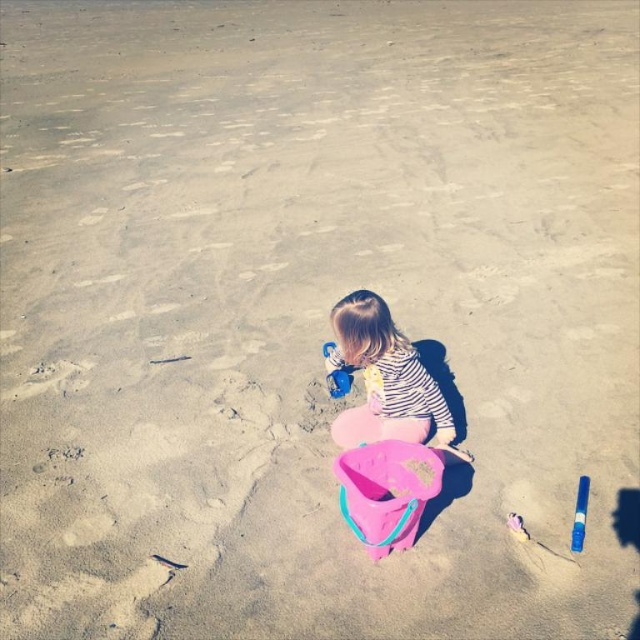
Does striped fabric child at center appear on the right side of blue plastic bucket at center?

Correct, you'll find striped fabric child at center to the right of blue plastic bucket at center.

Can you confirm if striped fabric child at center is smaller than blue plastic bucket at center?

No, striped fabric child at center is not smaller than blue plastic bucket at center.

Is point (384, 387) farther from camera compared to point (339, 380)?

No, it is in front of (339, 380).

You are a GUI agent. You are given a task and a screenshot of the screen. Output one action in this format:
    pyautogui.click(x=<x>, y=<y>)
    Task: Click on the striped fabric child at center
    This screenshot has height=640, width=640.
    Given the screenshot: What is the action you would take?
    pyautogui.click(x=385, y=380)

Does striped fabric child at center come in front of blue plastic marker at lower right?

No, it is behind blue plastic marker at lower right.

The image size is (640, 640). Describe the element at coordinates (385, 380) in the screenshot. I see `striped fabric child at center` at that location.

This screenshot has height=640, width=640. Find the location of `striped fabric child at center`. striped fabric child at center is located at coordinates (385, 380).

Looking at this image, between pink plastic bucket at center and pink plastic shovel at lower center, which one appears on the right side from the viewer's perspective?

From the viewer's perspective, pink plastic shovel at lower center appears more on the right side.

Is point (352, 435) farther from camera compared to point (522, 524)?

Yes, point (352, 435) is farther from viewer.

The image size is (640, 640). I want to click on pink plastic bucket at center, so click(x=376, y=428).